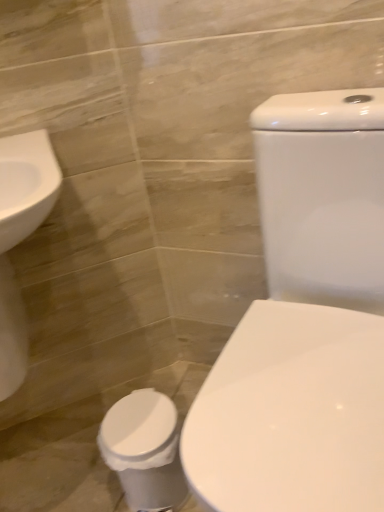
Question: Is white glossy toilet at center completely or partially inside white glossy toilet bowl at lower left?

Choices:
 (A) yes
 (B) no

Answer: (B)

Question: Is white glossy toilet bowl at lower left positioned in front of white glossy toilet at center?

Choices:
 (A) yes
 (B) no

Answer: (B)

Question: Is the position of white glossy toilet bowl at lower left more distant than that of white glossy toilet at center?

Choices:
 (A) no
 (B) yes

Answer: (B)

Question: Is white glossy toilet bowl at lower left next to white glossy toilet at center?

Choices:
 (A) no
 (B) yes

Answer: (A)

Question: From the image's perspective, would you say white glossy toilet bowl at lower left is positioned over white glossy toilet at center?

Choices:
 (A) no
 (B) yes

Answer: (A)

Question: Considering the relative positions of white glossy toilet bowl at lower left and white glossy toilet at center in the image provided, is white glossy toilet bowl at lower left to the left of white glossy toilet at center from the viewer's perspective?

Choices:
 (A) yes
 (B) no

Answer: (A)

Question: Is white glossy toilet at center smaller than white glossy toilet bowl at lower left?

Choices:
 (A) no
 (B) yes

Answer: (A)

Question: From the image's perspective, would you say white glossy toilet at center is shown under white glossy toilet bowl at lower left?

Choices:
 (A) no
 (B) yes

Answer: (A)

Question: From a real-world perspective, is white glossy toilet at center over white glossy toilet bowl at lower left?

Choices:
 (A) no
 (B) yes

Answer: (B)

Question: Is white glossy toilet bowl at lower left inside white glossy toilet at center?

Choices:
 (A) yes
 (B) no

Answer: (B)

Question: Considering the relative sizes of white glossy toilet at center and white glossy toilet bowl at lower left in the image provided, is white glossy toilet at center shorter than white glossy toilet bowl at lower left?

Choices:
 (A) yes
 (B) no

Answer: (B)

Question: Considering the relative positions of white glossy toilet at center and white glossy toilet bowl at lower left in the image provided, is white glossy toilet at center in front of white glossy toilet bowl at lower left?

Choices:
 (A) yes
 (B) no

Answer: (A)

Question: Is point (345, 137) positioned closer to the camera than point (168, 434)?

Choices:
 (A) closer
 (B) farther

Answer: (A)